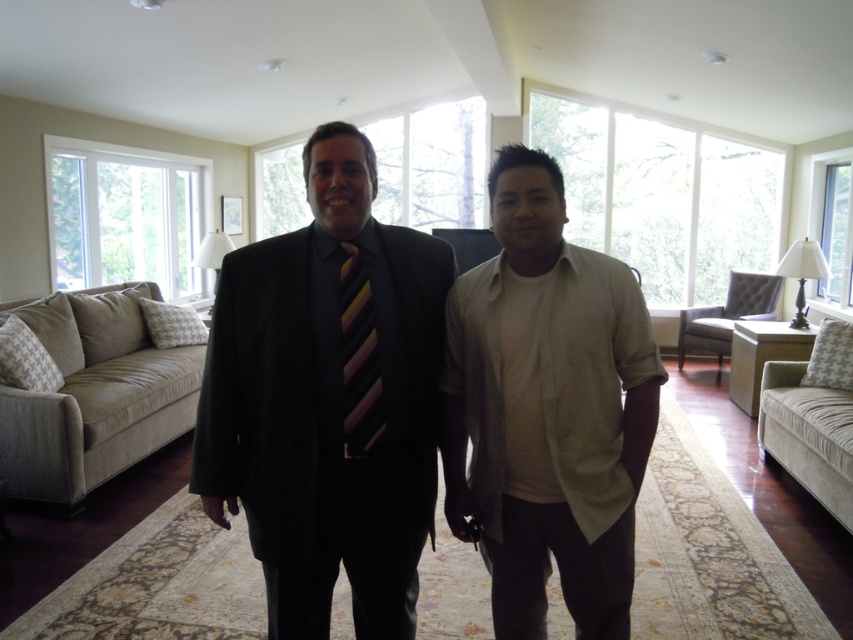
Question: Can you confirm if light beige cotton shirt at center is wider than beige fabric sofa at left?

Choices:
 (A) no
 (B) yes

Answer: (A)

Question: Can you confirm if beige fabric sofa at left is wider than beige fabric armchair at right?

Choices:
 (A) no
 (B) yes

Answer: (B)

Question: Which point is closer to the camera?

Choices:
 (A) (519, 540)
 (B) (436, 419)

Answer: (A)

Question: Which point appears farthest from the camera in this image?

Choices:
 (A) (344, 243)
 (B) (598, 632)
 (C) (769, 273)

Answer: (C)

Question: Considering the real-world distances, which object is farthest from the striped fabric tie at center?

Choices:
 (A) beige fabric armchair at right
 (B) dark blue wool suit at center
 (C) light beige cotton shirt at center

Answer: (A)

Question: Is dark blue wool suit at center bigger than beige fabric sofa at left?

Choices:
 (A) yes
 (B) no

Answer: (B)